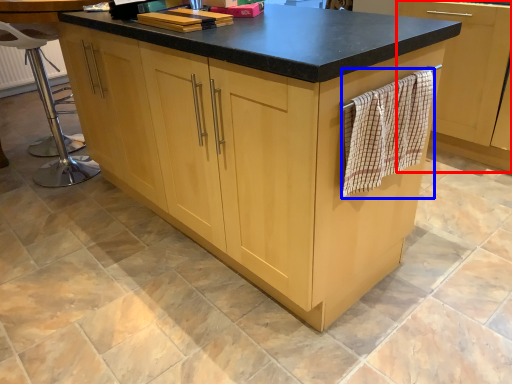
Question: Which point is closer to the camera, cabinetry (highlighted by a red box) or bath towel (highlighted by a blue box)?

Choices:
 (A) cabinetry
 (B) bath towel

Answer: (B)